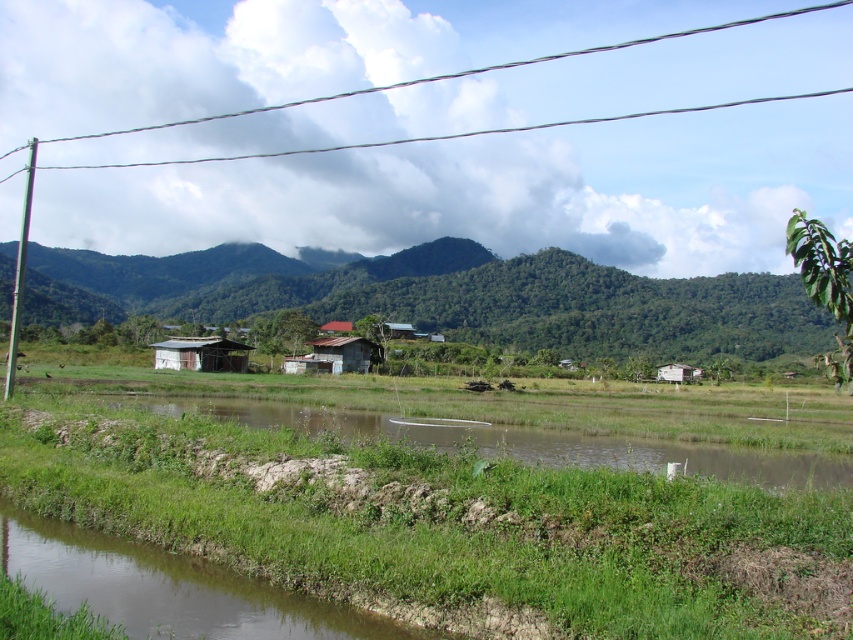
Does rusty corrugated hut at center appear over white wooden hut at center?

Yes.

Between point (375, 356) and point (700, 368), which one is positioned behind?

The point (700, 368) is behind.

Is point (364, 348) behind point (701, 369)?

No, (364, 348) is in front of (701, 369).

The width and height of the screenshot is (853, 640). Identify the location of rusty corrugated hut at center. [345, 353].

Which is more to the right, metallic wire at upper center or rusty corrugated hut at center?

metallic wire at upper center is more to the right.

Who is taller, metallic wire at upper center or rusty corrugated hut at center?

Standing taller between the two is metallic wire at upper center.

Describe the element at coordinates (466, 72) in the screenshot. I see `metallic wire at upper center` at that location.

You are a GUI agent. You are given a task and a screenshot of the screen. Output one action in this format:
    pyautogui.click(x=<x>, y=<y>)
    Task: Click on the metallic wire at upper center
    
    Given the screenshot: What is the action you would take?
    click(x=466, y=72)

Is metallic wire at upper center bigger than brown corrugated metal hut at lower left?

Indeed, metallic wire at upper center has a larger size compared to brown corrugated metal hut at lower left.

Is metallic wire at upper center positioned before brown corrugated metal hut at lower left?

No, it is behind brown corrugated metal hut at lower left.

Which is behind, point (357, 147) or point (218, 356)?

Positioned behind is point (357, 147).

This screenshot has width=853, height=640. What are the coordinates of `metallic wire at upper center` in the screenshot? It's located at (466, 72).